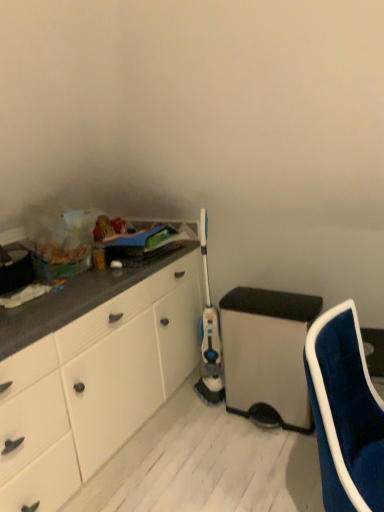
The height and width of the screenshot is (512, 384). I want to click on free region on the left part of matte plastic trash can at lower right, so click(196, 429).